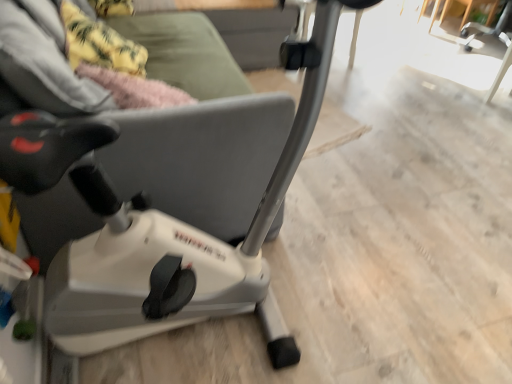
The image size is (512, 384). I want to click on unoccupied region to the right of white plastic stationary bicycle at center, so click(x=389, y=287).